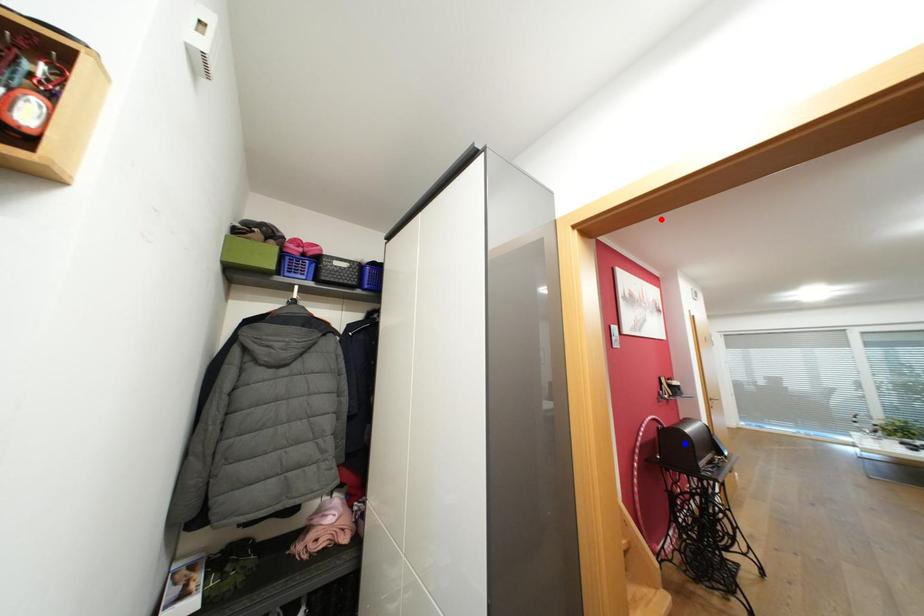
Question: Two points are marked on the image. Which point is closer to the camera?

Choices:
 (A) Blue point is closer.
 (B) Red point is closer.

Answer: (B)